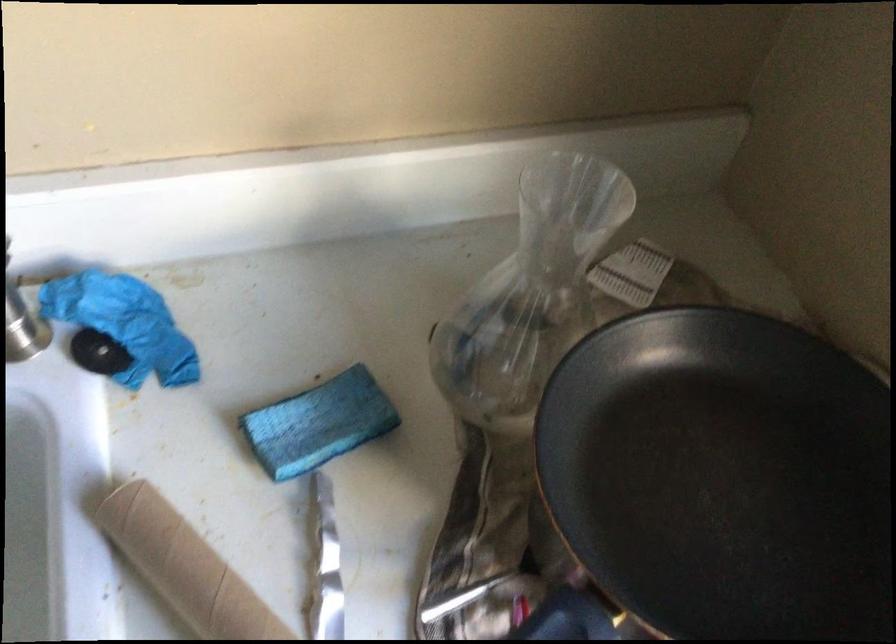
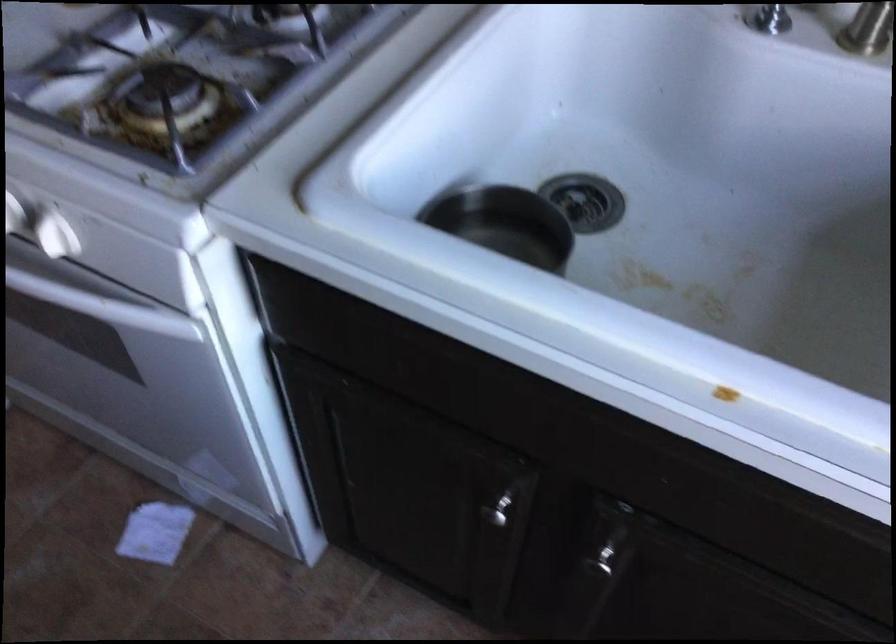
Question: The first image is from the beginning of the video and the second image is from the end. How did the camera likely rotate when shooting the video?

Choices:
 (A) Left
 (B) Right
 (C) Up
 (D) Down

Answer: (A)